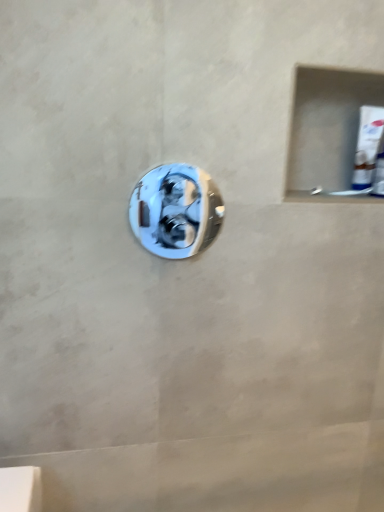
What do you see at coordinates (176, 211) in the screenshot? I see `polished chrome door handle at center` at bounding box center [176, 211].

Measure the distance between polished chrome door handle at center and camera.

The distance of polished chrome door handle at center from camera is 35.54 inches.

At what (x,y) coordinates should I click in order to perform the action: click on polished chrome door handle at center. Please return your answer as a coordinate pair (x, y). Looking at the image, I should click on (176, 211).

Describe the element at coordinates (367, 145) in the screenshot. I see `white glossy tube at upper right` at that location.

This screenshot has height=512, width=384. I want to click on white glossy tube at upper right, so click(367, 145).

This screenshot has height=512, width=384. What are the coordinates of `polished chrome door handle at center` in the screenshot? It's located at (176, 211).

Based on their positions, is white glossy tube at upper right located to the left or right of polished chrome door handle at center?

In the image, white glossy tube at upper right appears on the right side of polished chrome door handle at center.

Is the depth of white glossy tube at upper right less than that of polished chrome door handle at center?

No, it is behind polished chrome door handle at center.

Is point (365, 137) farther from viewer compared to point (141, 219)?

Yes, it is behind point (141, 219).

From the image's perspective, which is below, white glossy tube at upper right or polished chrome door handle at center?

From the image's view, polished chrome door handle at center is below.

From a real-world perspective, is white glossy tube at upper right beneath polished chrome door handle at center?

Incorrect, from a real-world perspective, white glossy tube at upper right is higher than polished chrome door handle at center.

In terms of width, does white glossy tube at upper right look wider or thinner when compared to polished chrome door handle at center?

Considering their sizes, white glossy tube at upper right looks broader than polished chrome door handle at center.

In the scene shown: Who is taller, white glossy tube at upper right or polished chrome door handle at center?

Standing taller between the two is polished chrome door handle at center.

Based on their sizes in the image, would you say white glossy tube at upper right is bigger or smaller than polished chrome door handle at center?

Considering their sizes, white glossy tube at upper right takes up more space than polished chrome door handle at center.

Could polished chrome door handle at center be considered to be inside white glossy tube at upper right?

No, polished chrome door handle at center is not a part of white glossy tube at upper right.

Is white glossy tube at upper right next to polished chrome door handle at center and touching it?

There is a gap between white glossy tube at upper right and polished chrome door handle at center.

Is white glossy tube at upper right facing away from polished chrome door handle at center?

white glossy tube at upper right does not have its back to polished chrome door handle at center.

How distant is white glossy tube at upper right from polished chrome door handle at center?

white glossy tube at upper right and polished chrome door handle at center are 18.25 inches apart from each other.

Where is `toothpaste on the right of polished chrome door handle at center`? The image size is (384, 512). toothpaste on the right of polished chrome door handle at center is located at coordinates (367, 145).

Considering the relative positions of polished chrome door handle at center and white glossy tube at upper right in the image provided, is polished chrome door handle at center to the left of white glossy tube at upper right from the viewer's perspective?

Correct, you'll find polished chrome door handle at center to the left of white glossy tube at upper right.

Considering the positions of objects polished chrome door handle at center and white glossy tube at upper right in the image provided, who is in front, polished chrome door handle at center or white glossy tube at upper right?

Positioned in front is polished chrome door handle at center.

Considering the points (187, 178) and (372, 112), which point is in front, point (187, 178) or point (372, 112)?

The point (187, 178) is in front.

From the picture: From the image's perspective, is polished chrome door handle at center positioned above or below white glossy tube at upper right?

Clearly, from the image's perspective, polished chrome door handle at center is below white glossy tube at upper right.

From a real-world perspective, who is located lower, polished chrome door handle at center or white glossy tube at upper right?

From a 3D spatial view, polished chrome door handle at center is below.

Considering the sizes of polished chrome door handle at center and white glossy tube at upper right in the image, is polished chrome door handle at center wider or thinner than white glossy tube at upper right?

Clearly, polished chrome door handle at center has less width compared to white glossy tube at upper right.

Based on the photo, between polished chrome door handle at center and white glossy tube at upper right, which one has less height?

Standing shorter between the two is white glossy tube at upper right.

Is polished chrome door handle at center smaller than white glossy tube at upper right?

Yes.

Looking at this image, would you say polished chrome door handle at center contains white glossy tube at upper right?

No, white glossy tube at upper right is not a part of polished chrome door handle at center.

Is polished chrome door handle at center next to white glossy tube at upper right and touching it?

No.

Is polished chrome door handle at center facing towards white glossy tube at upper right?

No, polished chrome door handle at center is not aimed at white glossy tube at upper right.

Looking at this image, how different are the orientations of polished chrome door handle at center and white glossy tube at upper right in degrees?

The facing directions of polished chrome door handle at center and white glossy tube at upper right are 0.0272 degrees apart.

You are a GUI agent. You are given a task and a screenshot of the screen. Output one action in this format:
    pyautogui.click(x=<x>, y=<y>)
    Task: Click on the door handle on the left of white glossy tube at upper right
    The width and height of the screenshot is (384, 512).
    Given the screenshot: What is the action you would take?
    pyautogui.click(x=176, y=211)

Find the location of a particular element. The image size is (384, 512). door handle that appears below the white glossy tube at upper right (from a real-world perspective) is located at coordinates (176, 211).

The image size is (384, 512). What are the coordinates of `toothpaste on the right side of polished chrome door handle at center` in the screenshot? It's located at (367, 145).